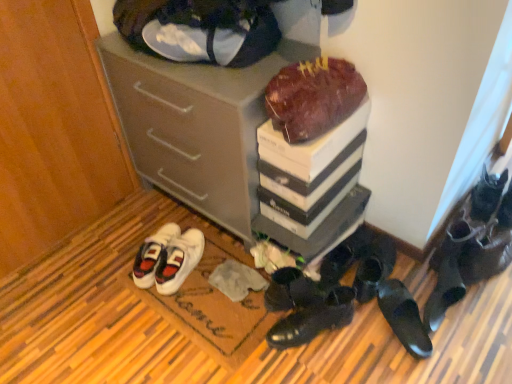
What are the coordinates of `free spot to the left of white fabric doormat at lower center` in the screenshot? It's located at [79, 303].